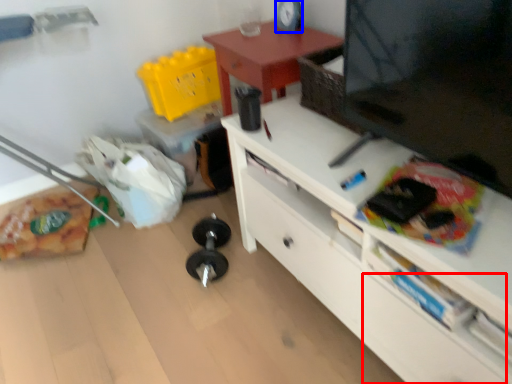
Question: Which object is further to the camera taking this photo, drawer (highlighted by a red box) or clock (highlighted by a blue box)?

Choices:
 (A) drawer
 (B) clock

Answer: (B)